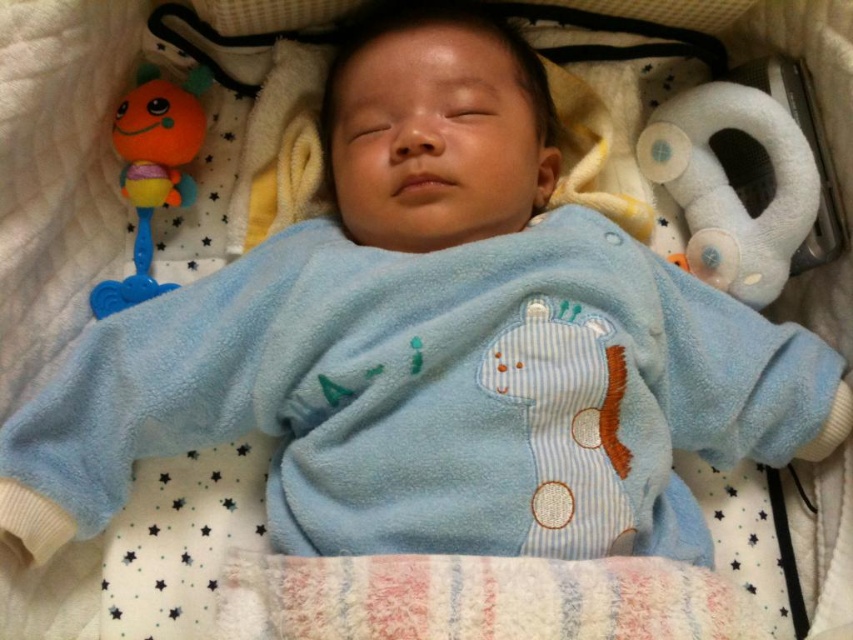
Question: Estimate the real-world distances between objects in this image. Which object is closer to the orange rubber rattle at upper left?

Choices:
 (A) white plush teether at upper right
 (B) smooth blue baby at center

Answer: (B)

Question: Which of the following is the closest to the observer?

Choices:
 (A) (680, 204)
 (B) (381, 76)

Answer: (B)

Question: Is smooth blue baby at center to the left of orange rubber rattle at upper left from the viewer's perspective?

Choices:
 (A) yes
 (B) no

Answer: (B)

Question: In this image, where is smooth blue baby at center located relative to orange rubber rattle at upper left?

Choices:
 (A) left
 (B) right

Answer: (B)

Question: Among these objects, which one is farthest from the camera?

Choices:
 (A) orange rubber rattle at upper left
 (B) smooth blue baby at center

Answer: (A)

Question: Is white plush teether at upper right smaller than orange rubber rattle at upper left?

Choices:
 (A) yes
 (B) no

Answer: (B)